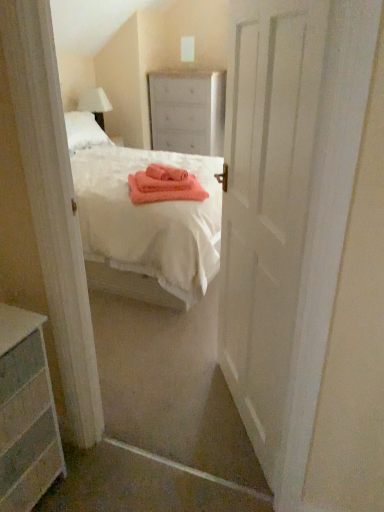
Question: From the image's perspective, is white wood dresser at upper center under white matte door at center?

Choices:
 (A) yes
 (B) no

Answer: (B)

Question: Can you confirm if white wood dresser at upper center is taller than white matte door at center?

Choices:
 (A) yes
 (B) no

Answer: (B)

Question: Is white wood dresser at upper center behind white matte door at center?

Choices:
 (A) yes
 (B) no

Answer: (A)

Question: Is white matte door at center a part of white wood dresser at upper center?

Choices:
 (A) no
 (B) yes

Answer: (A)

Question: Is white wood dresser at upper center shorter than white matte door at center?

Choices:
 (A) yes
 (B) no

Answer: (A)

Question: Considering the relative sizes of white wood dresser at upper center and white matte door at center in the image provided, is white wood dresser at upper center thinner than white matte door at center?

Choices:
 (A) yes
 (B) no

Answer: (B)

Question: Can you confirm if gray striped dresser at lower left is bigger than white matte door at center?

Choices:
 (A) yes
 (B) no

Answer: (B)

Question: Is gray striped dresser at lower left shorter than white matte door at center?

Choices:
 (A) no
 (B) yes

Answer: (B)

Question: Can you see gray striped dresser at lower left touching white matte door at center?

Choices:
 (A) yes
 (B) no

Answer: (B)

Question: Could white matte door at center be considered to be inside gray striped dresser at lower left?

Choices:
 (A) yes
 (B) no

Answer: (B)

Question: Considering the relative sizes of gray striped dresser at lower left and white matte door at center in the image provided, is gray striped dresser at lower left taller than white matte door at center?

Choices:
 (A) yes
 (B) no

Answer: (B)

Question: Considering the relative positions of gray striped dresser at lower left and white matte door at center in the image provided, is gray striped dresser at lower left in front of white matte door at center?

Choices:
 (A) no
 (B) yes

Answer: (A)

Question: Considering the relative sizes of white fabric lampshade at upper left and white wood dresser at upper center in the image provided, is white fabric lampshade at upper left smaller than white wood dresser at upper center?

Choices:
 (A) no
 (B) yes

Answer: (B)